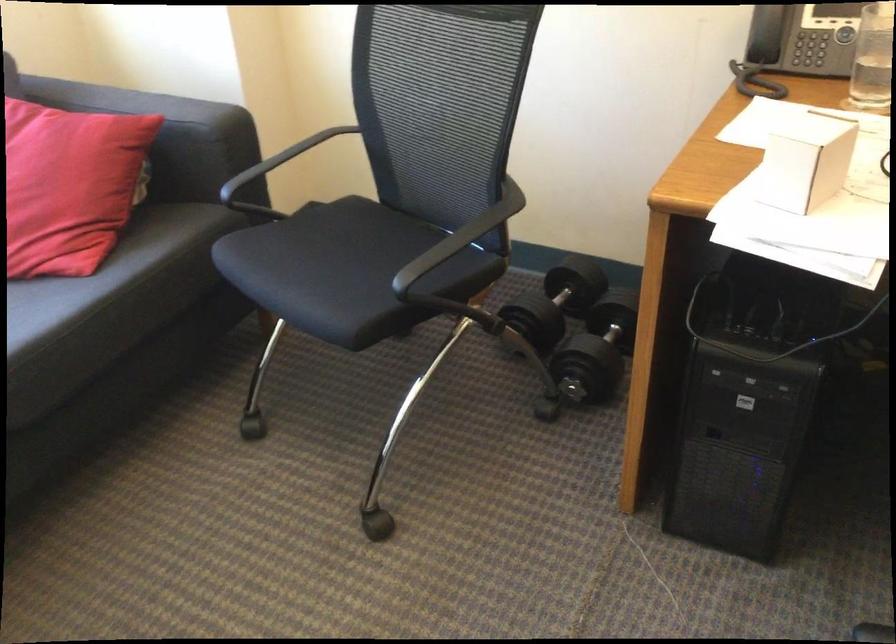
Find the location of a particular element. The width and height of the screenshot is (896, 644). small white box is located at coordinates (805, 162).